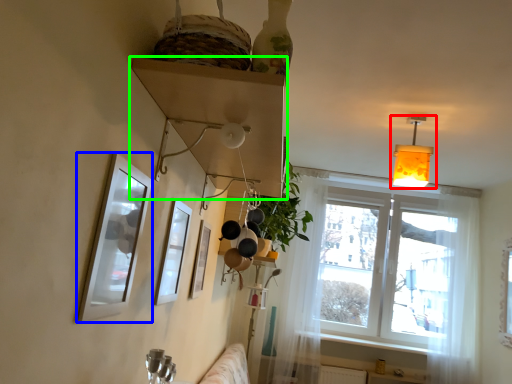
Question: Which object is positioned farthest from lamp (highlighted by a red box)? Select from picture frame (highlighted by a blue box) and shelf (highlighted by a green box).

Choices:
 (A) picture frame
 (B) shelf

Answer: (A)